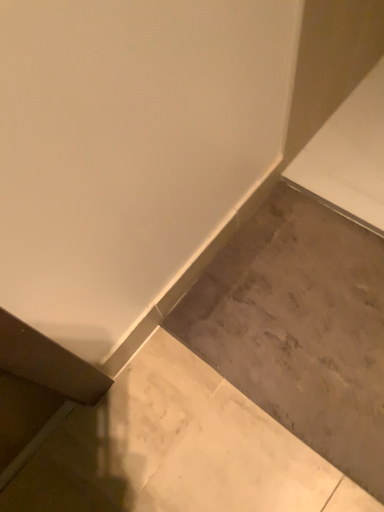
Identify the location of gray concrete at lower right. This screenshot has height=512, width=384. (300, 327).

Describe the element at coordinates (300, 327) in the screenshot. I see `gray concrete at lower right` at that location.

Measure the distance between point (366, 459) and camera.

A distance of 33.54 inches exists between point (366, 459) and camera.

The width and height of the screenshot is (384, 512). Identify the location of gray concrete at lower right. (300, 327).